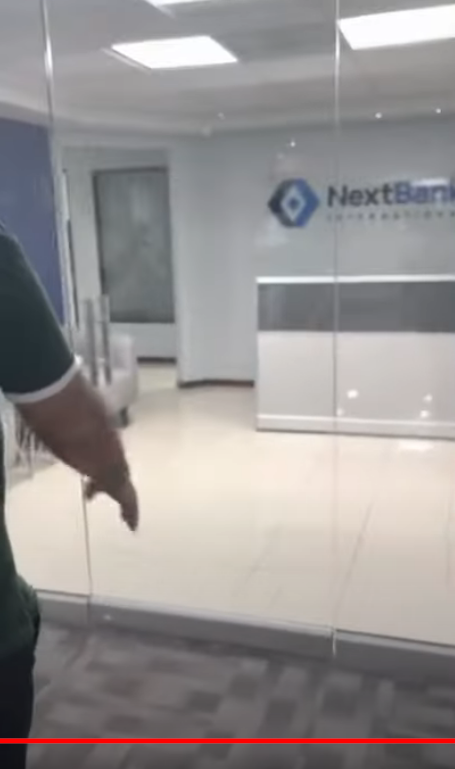
The image size is (455, 769). Find the location of `glass`. glass is located at coordinates (54, 548), (259, 570), (391, 573).